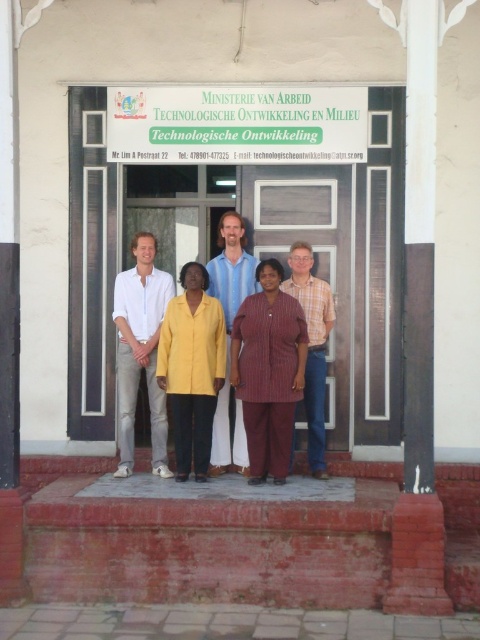
Question: Can you confirm if yellow matte shirt at center is positioned to the left of white cotton shirt at center?

Choices:
 (A) yes
 (B) no

Answer: (B)

Question: Which object is closer to the camera taking this photo?

Choices:
 (A) yellow cotton shirt at center
 (B) white cotton shirt at center
 (C) brick at lower center
 (D) blue cotton shirt at center

Answer: (C)

Question: Can you confirm if yellow matte shirt at center is positioned above plaid fabric shirt at center?

Choices:
 (A) yes
 (B) no

Answer: (B)

Question: Which is nearer to the plaid fabric shirt at center?

Choices:
 (A) brick at lower center
 (B) blue cotton shirt at center
 (C) maroon striped dress at center

Answer: (C)

Question: Which object appears closest to the camera in this image?

Choices:
 (A) plaid fabric shirt at center
 (B) brick at lower center
 (C) white cotton shirt at center

Answer: (B)

Question: Is maroon striped dress at center to the left of yellow matte shirt at center from the viewer's perspective?

Choices:
 (A) yes
 (B) no

Answer: (B)